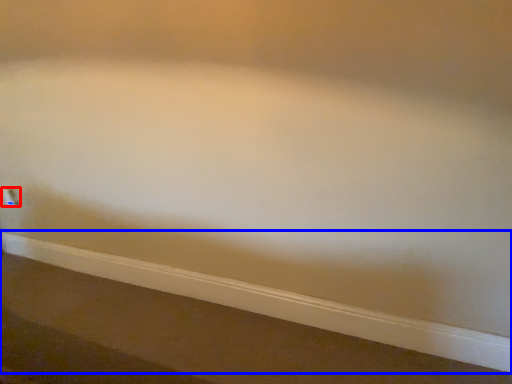
Question: Which object is further to the camera taking this photo, electric outlet (highlighted by a red box) or ledge (highlighted by a blue box)?

Choices:
 (A) electric outlet
 (B) ledge

Answer: (A)